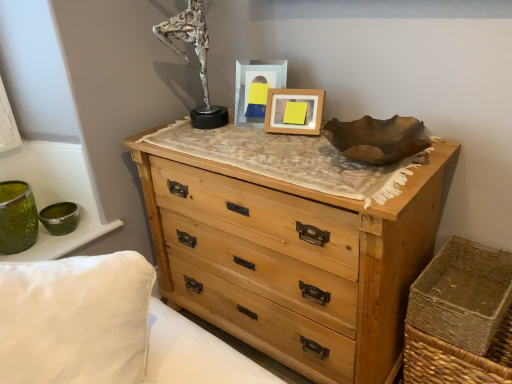
Question: Is the surface of matte plastic picture frame at center, which is counted as the 1th picture frame, starting from the left, in direct contact with silver metallic sculpture at upper center?

Choices:
 (A) no
 (B) yes

Answer: (A)

Question: From the image's perspective, is matte plastic picture frame at center, the 2th picture frame from the right, located beneath silver metallic sculpture at upper center?

Choices:
 (A) yes
 (B) no

Answer: (A)

Question: Can you confirm if matte plastic picture frame at center, the 2th picture frame from the right, is positioned to the left of silver metallic sculpture at upper center?

Choices:
 (A) yes
 (B) no

Answer: (B)

Question: Considering the relative sizes of matte plastic picture frame at center, which is counted as the 1th picture frame, starting from the left, and silver metallic sculpture at upper center in the image provided, is matte plastic picture frame at center, which is counted as the 1th picture frame, starting from the left, wider than silver metallic sculpture at upper center?

Choices:
 (A) no
 (B) yes

Answer: (A)

Question: Is matte plastic picture frame at center, which is counted as the 1th picture frame, starting from the left, at the right side of silver metallic sculpture at upper center?

Choices:
 (A) yes
 (B) no

Answer: (A)

Question: Considering the relative sizes of matte plastic picture frame at center, which is counted as the 1th picture frame, starting from the left, and silver metallic sculpture at upper center in the image provided, is matte plastic picture frame at center, which is counted as the 1th picture frame, starting from the left, smaller than silver metallic sculpture at upper center?

Choices:
 (A) no
 (B) yes

Answer: (B)

Question: Is brown woven basket at lower right thinner than natural wood chest of drawers at center?

Choices:
 (A) yes
 (B) no

Answer: (A)

Question: Is brown woven basket at lower right positioned beyond the bounds of natural wood chest of drawers at center?

Choices:
 (A) yes
 (B) no

Answer: (A)

Question: Can you confirm if brown woven basket at lower right is wider than natural wood chest of drawers at center?

Choices:
 (A) no
 (B) yes

Answer: (A)

Question: Does brown woven basket at lower right have a smaller size compared to natural wood chest of drawers at center?

Choices:
 (A) yes
 (B) no

Answer: (A)

Question: Is brown woven basket at lower right further to camera compared to natural wood chest of drawers at center?

Choices:
 (A) no
 (B) yes

Answer: (B)

Question: Is brown woven basket at lower right shorter than natural wood chest of drawers at center?

Choices:
 (A) yes
 (B) no

Answer: (A)

Question: Can you confirm if wooden picture frame at center, marked as the 1th picture frame in a right-to-left arrangement, is positioned to the right of matte plastic picture frame at center, the 2th picture frame from the right?

Choices:
 (A) yes
 (B) no

Answer: (A)